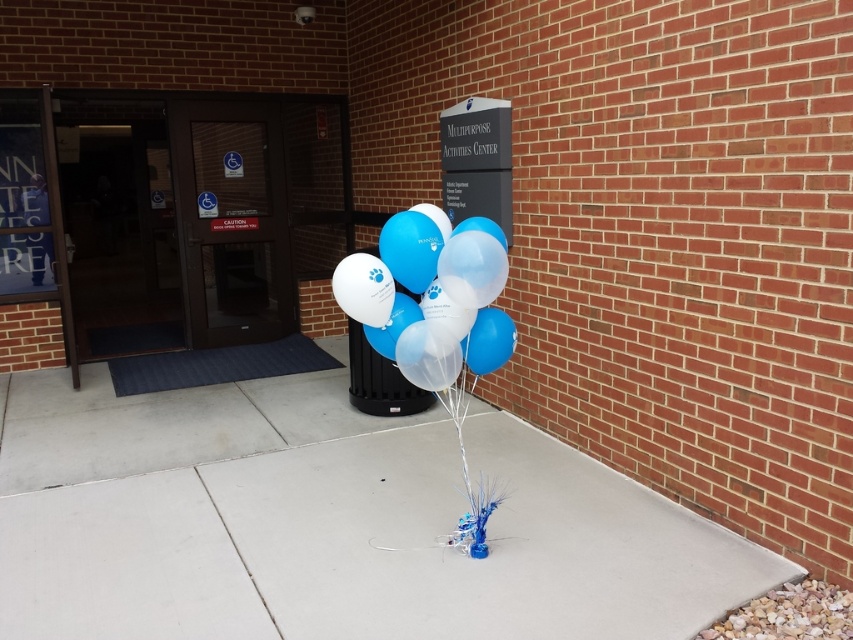
Question: From the image, what is the correct spatial relationship of white concrete pavement at center in relation to translucent glossy balloons at center?

Choices:
 (A) left
 (B) right

Answer: (A)

Question: Which point appears farthest from the camera in this image?

Choices:
 (A) (97, 461)
 (B) (432, 250)

Answer: (A)

Question: In this image, where is white concrete pavement at center located relative to translucent glossy balloons at center?

Choices:
 (A) above
 (B) below

Answer: (B)

Question: From the image, what is the correct spatial relationship of white concrete pavement at center in relation to translucent glossy balloons at center?

Choices:
 (A) right
 (B) left

Answer: (B)